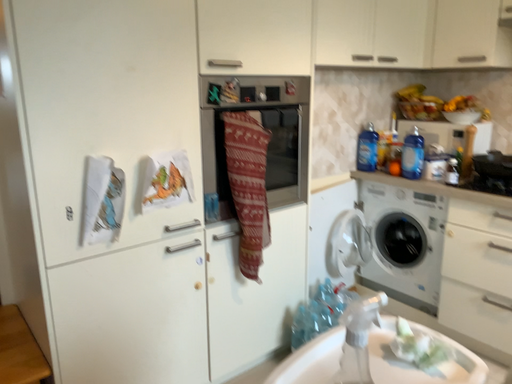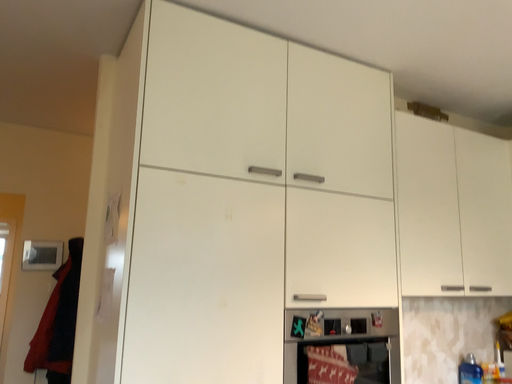
Question: Which way did the camera rotate in the video?

Choices:
 (A) rotated downward
 (B) rotated upward

Answer: (B)